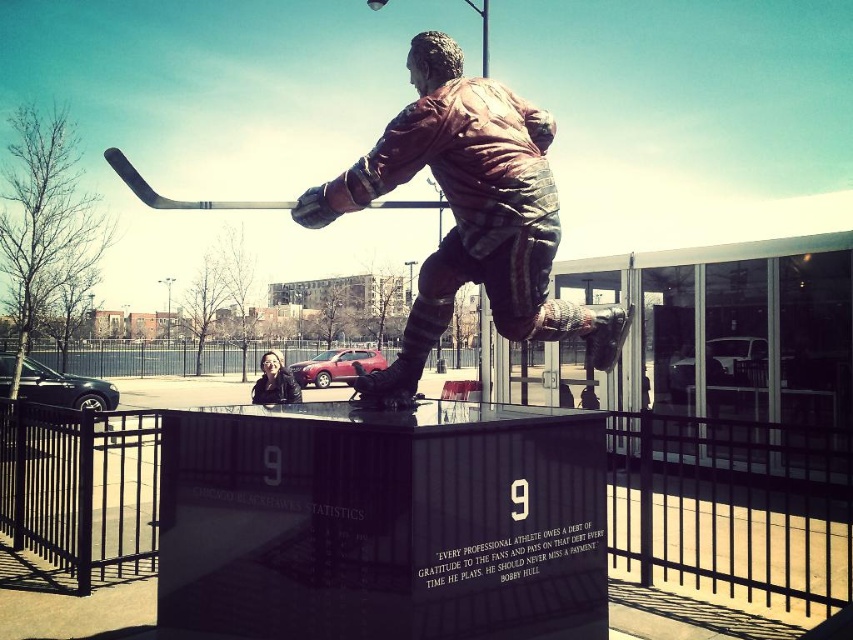
Is point (624, 332) positioned after point (256, 387)?

No, (624, 332) is in front of (256, 387).

Between point (463, 280) and point (287, 372), which one is positioned behind?

Point (287, 372)

Between point (505, 273) and point (300, 394), which one is positioned in front?

Positioned in front is point (505, 273).

Where is `shiny bronze statue at center`? The width and height of the screenshot is (853, 640). shiny bronze statue at center is located at coordinates (468, 214).